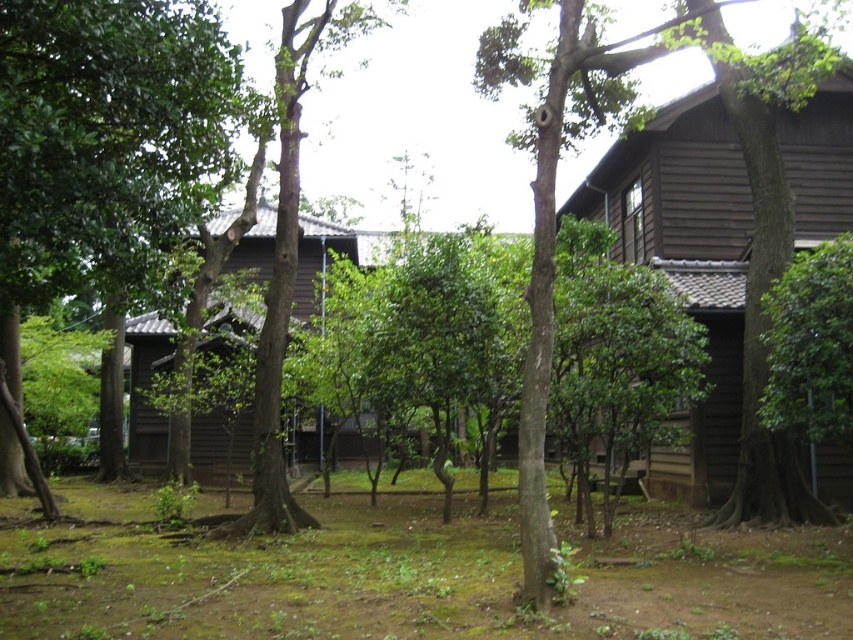
You are planning to set up a small garden in the green mossy ground at center and the wooden hut at right. Which area has a wider space to accommodate more plants?

The green mossy ground at center has a larger width than the wooden hut at right, so it can accommodate more plants.

You are standing in front of the traditional wooden building and want to walk to the point closer to you between point (440, 611) and point (136, 330). Which point should you head towards?

You should head towards point (440, 611) because it is closer to you than point (136, 330).